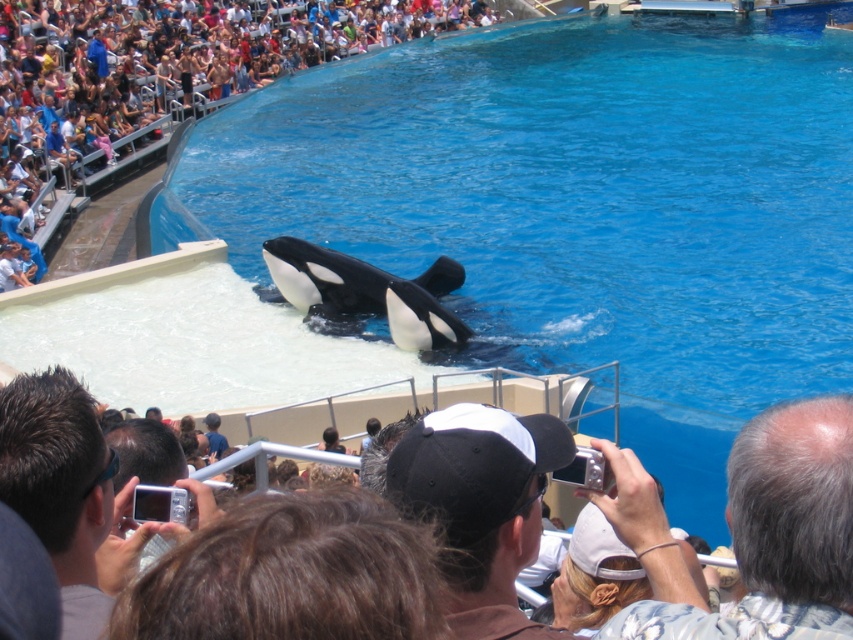
You are a photographer at the marine park and want to capture both the black matte baseball cap at center and the black smooth orca at center in a single frame. Considering their sizes, which object should you zoom in on to ensure both are visible?

The black matte baseball cap at center occupies less space than the black smooth orca at center, so you should zoom in on the black smooth orca at center to include both objects in the frame.

In the scene shown: You are a photographer at the marine park and want to capture the black smooth orca at center without the black smooth water at center in the shot. Is it possible to do so by adjusting your camera angle?

The black smooth water at center is above the black smooth orca at center, so if you angle your camera downward, you can exclude the water and focus solely on the orca.

You are a photographer at the marine park and want to capture both the black smooth water at center and the black smooth orca at center in a single frame. Given their sizes, which one will appear bigger in your photo?

The black smooth water at center has a larger size compared to the black smooth orca at center, so it will appear bigger in the photo.